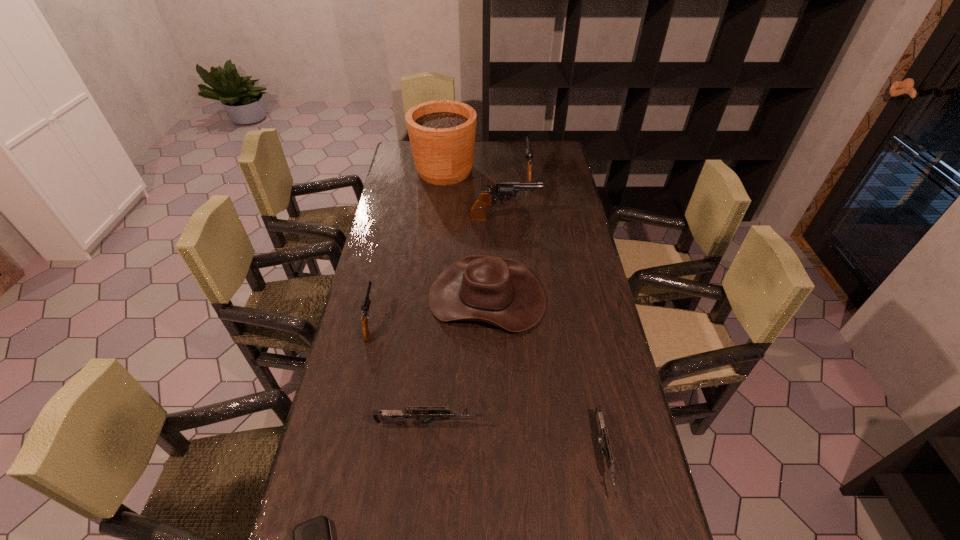
The width and height of the screenshot is (960, 540). Find the location of `vacant space located along the barrel of the fifth tallest object`. vacant space located along the barrel of the fifth tallest object is located at coordinates (385, 256).

Identify the location of free space located 0.210m aimed along the barrel of the bigger grey gun. (564, 424).

The image size is (960, 540). Find the location of `vacant area situated 0.060m aimed along the barrel of the shortest gun`. vacant area situated 0.060m aimed along the barrel of the shortest gun is located at coordinates (619, 533).

The height and width of the screenshot is (540, 960). I want to click on flowerpot positioned at the far edge, so click(x=442, y=133).

At what (x,y) coordinates should I click in order to perform the action: click on gun situated at the far edge. Please return your answer as a coordinate pair (x, y). Looking at the image, I should click on (528, 152).

Find the location of a particular element. This screenshot has width=960, height=540. flowerpot that is at the left edge is located at coordinates (442, 133).

Where is `object that is at the far left corner`? object that is at the far left corner is located at coordinates (442, 133).

The width and height of the screenshot is (960, 540). In the image, there is a desktop. Identify the location of vacant region at the far edge. (509, 160).

The image size is (960, 540). Identify the location of free space at the left edge. click(x=407, y=194).

The image size is (960, 540). Find the location of `free space at the right edge of the desktop`. free space at the right edge of the desktop is located at coordinates (583, 437).